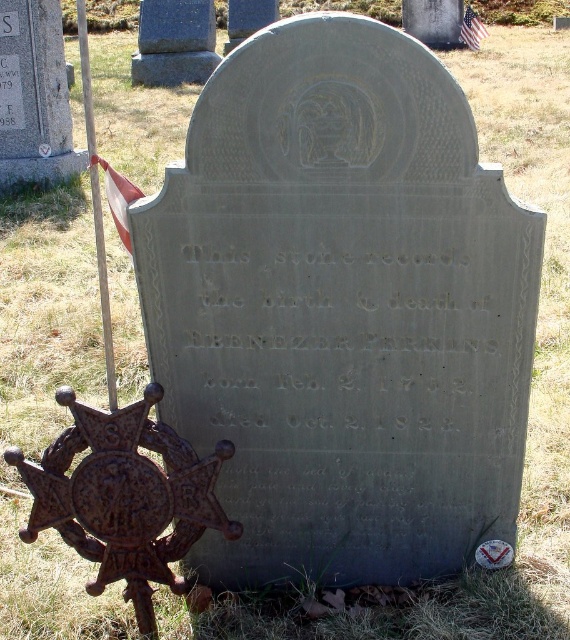
Question: Can you confirm if smooth gray stone at center is wider than american flag at upper center?

Choices:
 (A) yes
 (B) no

Answer: (A)

Question: Which of these objects is positioned farthest from the smooth gray stone at center?

Choices:
 (A) red fabric flag at upper left
 (B) wooden pole at left
 (C) rusty metal star at center
 (D) american flag at upper center

Answer: (C)

Question: Which point is closer to the camera?

Choices:
 (A) american flag at upper center
 (B) red fabric flag at upper left
 (C) wooden pole at left

Answer: (C)

Question: Can you confirm if rusty metal star at center is positioned above smooth gray stone at center?

Choices:
 (A) yes
 (B) no

Answer: (B)

Question: Does wooden pole at left appear under red fabric flag at upper left?

Choices:
 (A) yes
 (B) no

Answer: (B)

Question: Which of the following is the farthest from the observer?

Choices:
 (A) (86, 74)
 (B) (462, 33)
 (C) (75, 428)
 (D) (136, 193)

Answer: (B)